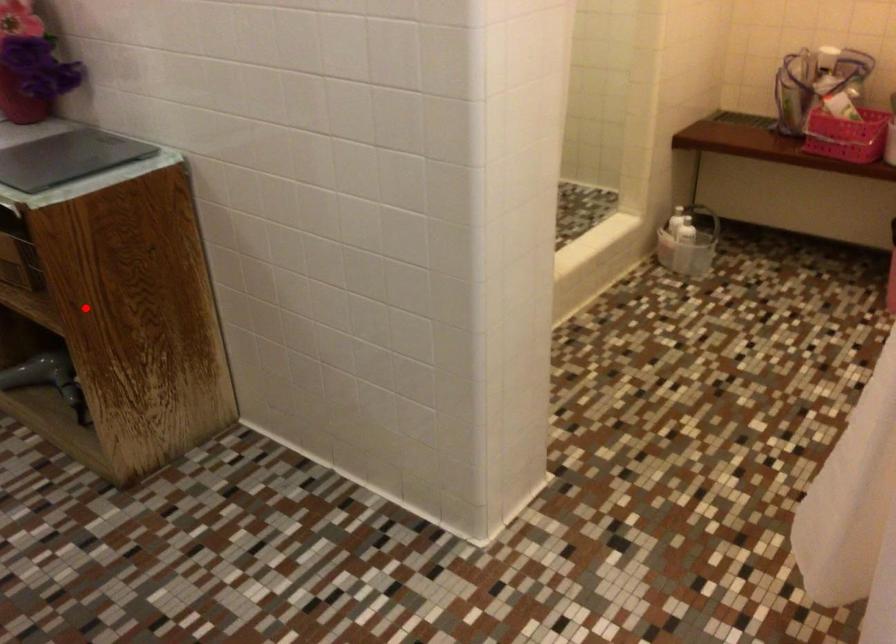
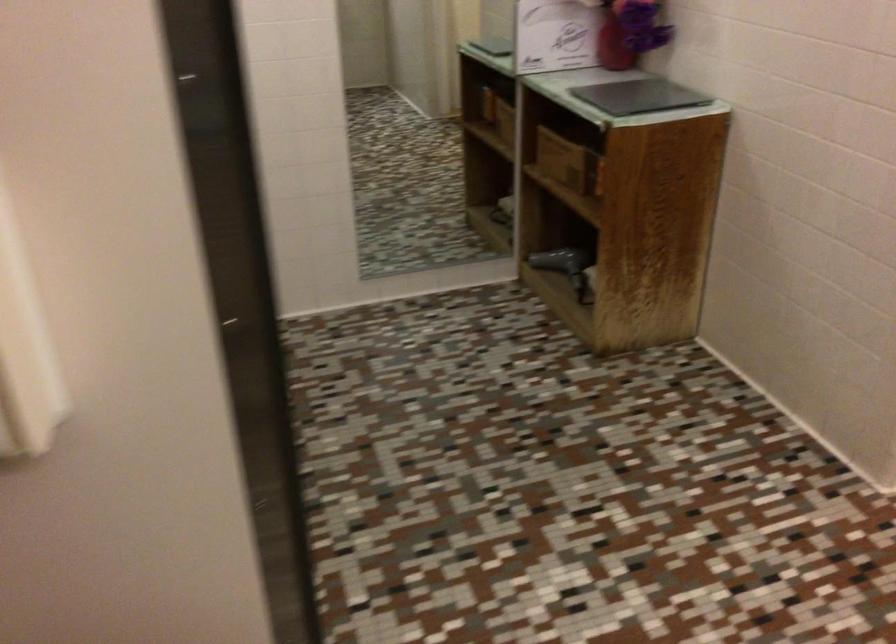
Find the pixel in the second image that matches the highlighted location in the first image.

(616, 207)